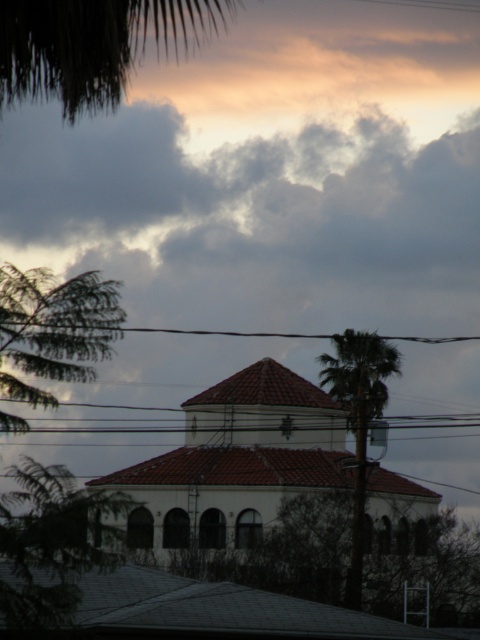
Can you confirm if green leafy tree at left is smaller than black wire at upper center?

Yes.

Between green leafy tree at left and black wire at upper center, which one is positioned higher?

green leafy tree at left

Which is in front, point (90, 307) or point (324, 333)?

Point (90, 307)

Identify the location of green leafy tree at left. This screenshot has height=640, width=480. (54, 328).

Can you confirm if green leafy tree at lower left is positioned below black wire at upper center?

Yes, green leafy tree at lower left is below black wire at upper center.

Is green leafy tree at lower left smaller than black wire at upper center?

Correct, green leafy tree at lower left occupies less space than black wire at upper center.

Who is more forward, (x=55, y=506) or (x=208, y=332)?

Point (x=55, y=506) is more forward.

Find the location of a particular element. Image resolution: width=480 pixels, height=640 pixels. green leafy tree at lower left is located at coordinates (52, 544).

How much distance is there between dark green leafy tree at upper left and black wire at upper center?

dark green leafy tree at upper left and black wire at upper center are 29.66 meters apart.

Is point (144, 29) positioned behind point (310, 337)?

Yes, point (144, 29) is farther from viewer.

You are a GUI agent. You are given a task and a screenshot of the screen. Output one action in this format:
    pyautogui.click(x=<x>, y=<y>)
    Task: Click on the dark green leafy tree at upper left
    
    Given the screenshot: What is the action you would take?
    pyautogui.click(x=93, y=45)

What are the coordinates of `dark green leafy tree at upper left` in the screenshot? It's located at (93, 45).